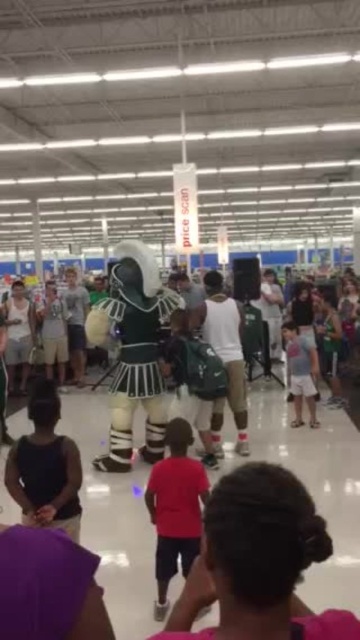
You are a photographer planning to take a group photo of the red matte shirt at center and light blue denim shorts at center. What is the minimum distance you need to step back to ensure both are fully in frame?

The red matte shirt at center and light blue denim shorts at center are 2.98 meters apart from each other. To ensure both are fully in frame, the photographer needs to step back at least 2.98 meters.

You are standing at the entrance of the store and see the knight costume in the foreground. There is a red matte shirt at center marked by point (x=174, y=508). If you walk directly towards the knight costume, will you pass through the location of the red matte shirt at center?

The point (x=174, y=508) marks the red matte shirt at center. Since you are walking directly towards the knight costume, which is in the foreground and facing the crowd, your path would lead you past the red matte shirt at center located at that point. Therefore, yes, you will pass through the location of the red matte shirt at center.

You are a customer in the store and you want to buy a shirt and shorts. You see the red matte shirt at center and the light blue denim shorts at center. Which one has a larger size?

The red matte shirt at center is bigger than the light blue denim shorts at center, so the shirt has a larger size.